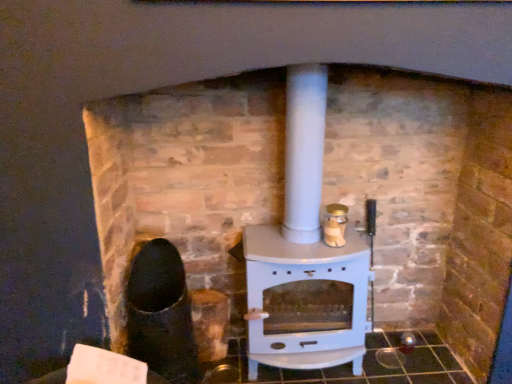
Question: From the image's perspective, would you say gold metallic jar at center-right is positioned over white glossy wood burning stove at center?

Choices:
 (A) yes
 (B) no

Answer: (A)

Question: Considering the relative sizes of gold metallic jar at center-right and white glossy wood burning stove at center in the image provided, is gold metallic jar at center-right wider than white glossy wood burning stove at center?

Choices:
 (A) yes
 (B) no

Answer: (B)

Question: Can you confirm if gold metallic jar at center-right is positioned to the left of white glossy wood burning stove at center?

Choices:
 (A) yes
 (B) no

Answer: (B)

Question: Are gold metallic jar at center-right and white glossy wood burning stove at center far apart?

Choices:
 (A) no
 (B) yes

Answer: (A)

Question: Does gold metallic jar at center-right come behind white glossy wood burning stove at center?

Choices:
 (A) yes
 (B) no

Answer: (A)

Question: From the image's perspective, is gold metallic jar at center-right beneath white glossy wood burning stove at center?

Choices:
 (A) yes
 (B) no

Answer: (B)

Question: Is white glossy wood burning stove at center outside gold metallic jar at center-right?

Choices:
 (A) no
 (B) yes

Answer: (B)

Question: Can gold metallic jar at center-right be found inside white glossy wood burning stove at center?

Choices:
 (A) yes
 (B) no

Answer: (A)

Question: Does white glossy wood burning stove at center have a lesser width compared to gold metallic jar at center-right?

Choices:
 (A) no
 (B) yes

Answer: (A)

Question: From the image's perspective, is white glossy wood burning stove at center below gold metallic jar at center-right?

Choices:
 (A) no
 (B) yes

Answer: (B)

Question: From a real-world perspective, is white glossy wood burning stove at center on top of gold metallic jar at center-right?

Choices:
 (A) yes
 (B) no

Answer: (B)

Question: Does white glossy wood burning stove at center appear on the left side of gold metallic jar at center-right?

Choices:
 (A) no
 (B) yes

Answer: (B)

Question: Is white glossy wood burning stove at center situated inside gold metallic jar at center-right or outside?

Choices:
 (A) outside
 (B) inside

Answer: (A)